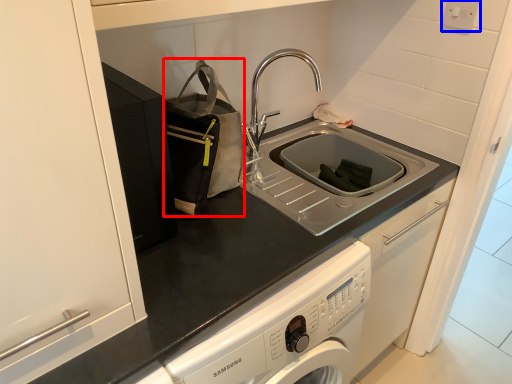
Question: Among these objects, which one is farthest to the camera, bag (highlighted by a red box) or electric outlet (highlighted by a blue box)?

Choices:
 (A) bag
 (B) electric outlet

Answer: (B)